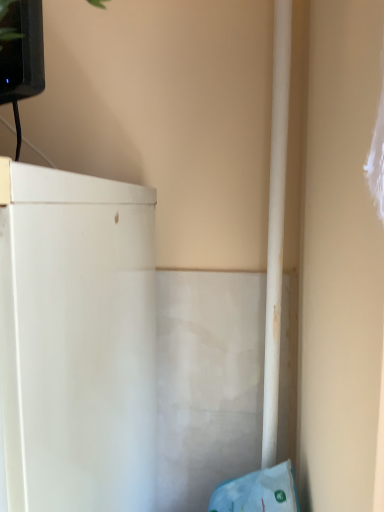
What do you see at coordinates (276, 227) in the screenshot? I see `white smooth pipe at right` at bounding box center [276, 227].

Identify the location of white smooth pipe at right. The height and width of the screenshot is (512, 384). pyautogui.click(x=276, y=227).

This screenshot has height=512, width=384. I want to click on white smooth pipe at right, so click(x=276, y=227).